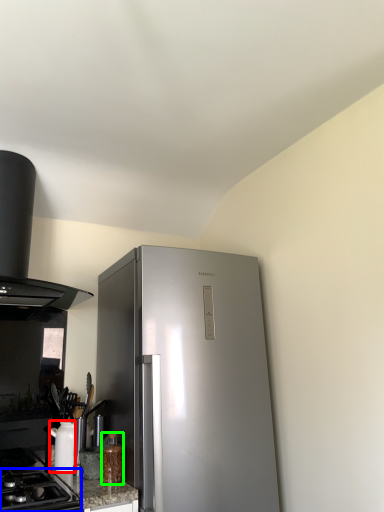
Question: Based on their relative distances, which object is farther from appliance (highlighted by a red box)? Choose from gas stove (highlighted by a blue box) and bottle (highlighted by a green box).

Choices:
 (A) gas stove
 (B) bottle

Answer: (B)